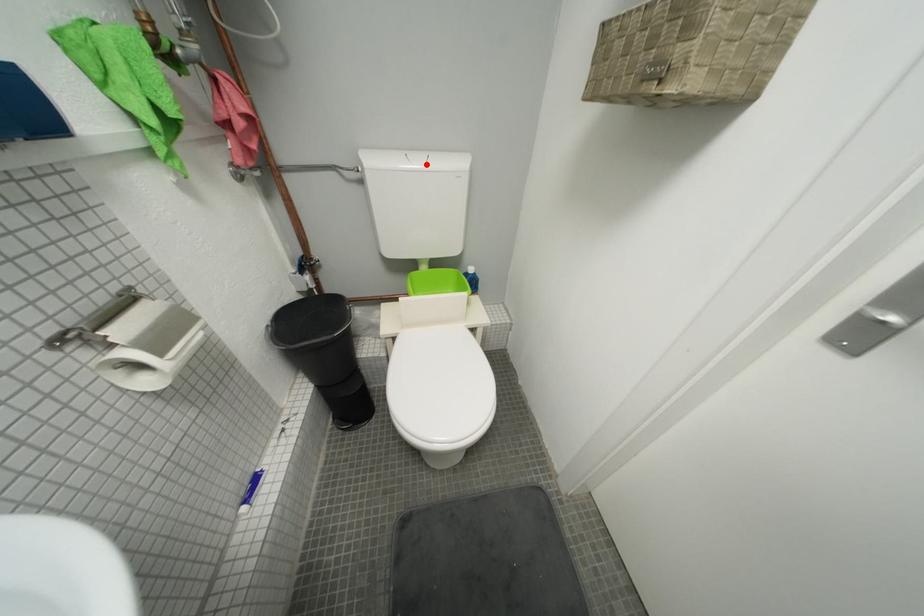
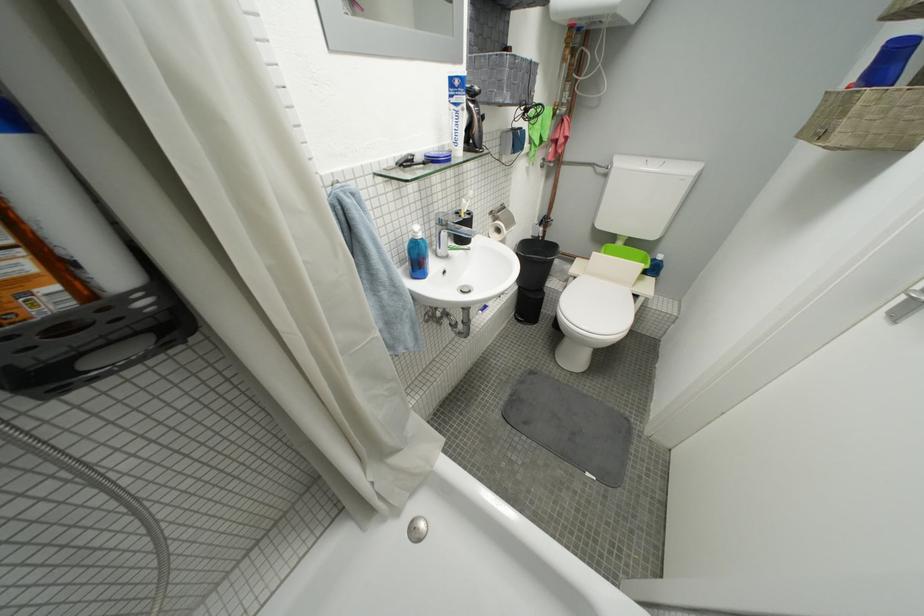
Find the pixel in the second image that matches the highlighted location in the first image.

(662, 169)